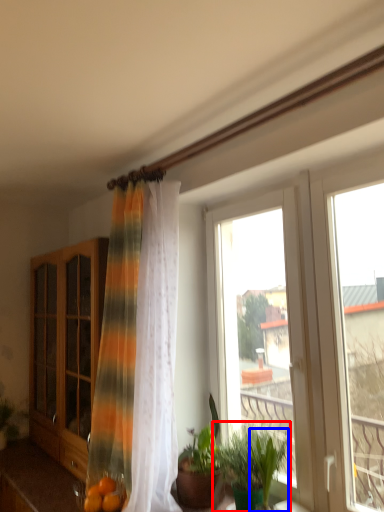
Question: Which point is further to the camera, houseplant (highlighted by a red box) or plant (highlighted by a blue box)?

Choices:
 (A) houseplant
 (B) plant

Answer: (A)